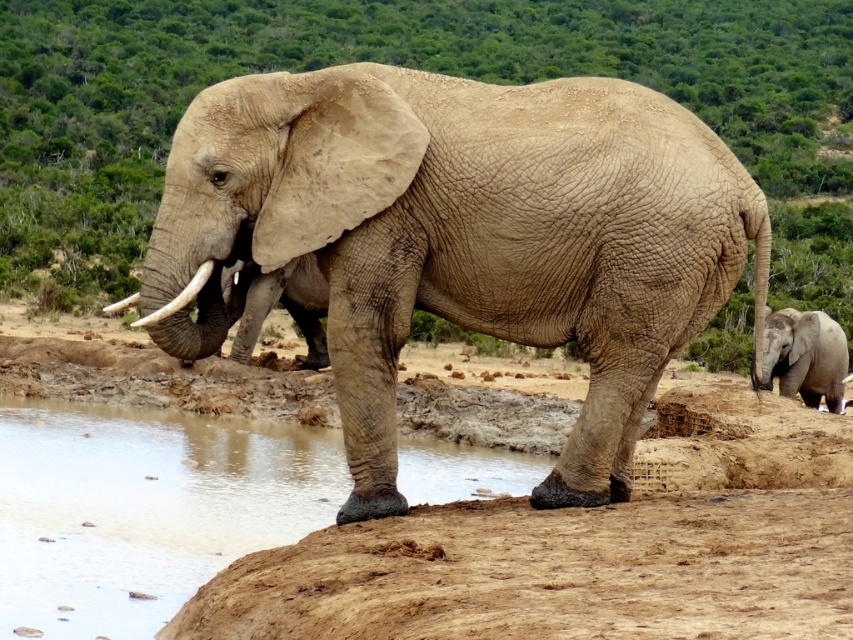
You are a wildlife photographer positioned at the edge of the waterhole. You need to capture a photo of both the rough textured elephant at center and the white ivory tusk at left in the same frame. Based on their positions, which direction should you move to ensure both are visible?

The rough textured elephant at center is to the right of the white ivory tusk at left. To include both in the frame, you should move to the left so that the white ivory tusk at left remains visible while the rough textured elephant at center stays in view.

You are a wildlife photographer aiming to capture a closeup shot of the white ivory tusk at left without disturbing the rough textured elephant at center. Given their sizes, which object should you focus on first to ensure the elephant doesn t block your view?

The rough textured elephant at center is taller than the white ivory tusk at left, so you should focus on the white ivory tusk at left first before the elephant obstructs the view.

You are a photographer trying to capture the rough textured elephant at center in the image. You have a camera with a zoom lens that can focus on objects within a 0.5 unit radius. Given that the point coordinates are normalized between 0 and 1, can you determine if the point at coordinates point (463, 237) will be within your camera focus range to capture the rough textured elephant at center?

The point at coordinates (463, 237) corresponds to the rough textured elephant at center, so yes, the camera can focus on it as it is within the focus range.